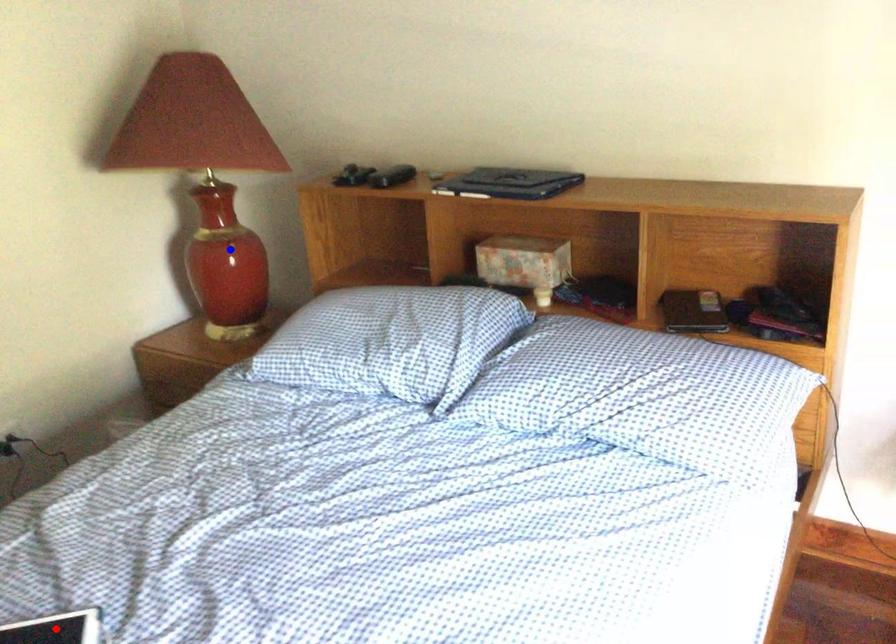
Question: Two points are marked on the image. Which point is closer to the camera?

Choices:
 (A) Blue point is closer.
 (B) Red point is closer.

Answer: (B)